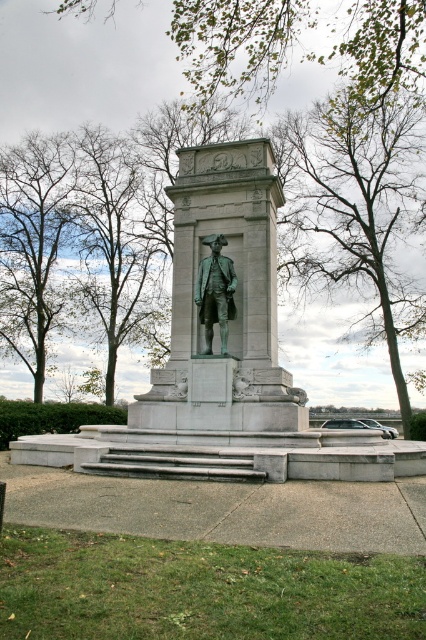
Question: Does bare branches at upper center appear on the right side of brown leafy tree at left?

Choices:
 (A) no
 (B) yes

Answer: (B)

Question: Is green polished stone statue at center wider than bronze statue at center?

Choices:
 (A) no
 (B) yes

Answer: (B)

Question: Observing the image, what is the correct spatial positioning of bare branches at upper center in reference to bare branches at left?

Choices:
 (A) right
 (B) left

Answer: (A)

Question: Among these points, which one is nearest to the camera?

Choices:
 (A) (126, 278)
 (B) (226, 269)

Answer: (B)

Question: Among these points, which one is nearest to the camera?

Choices:
 (A) (178, 150)
 (B) (74, 289)
 (C) (354, 205)
 (D) (416, 74)

Answer: (A)

Question: Which is nearer to the green polished stone statue at center?

Choices:
 (A) bare branches at left
 (B) bare branches at upper center

Answer: (B)